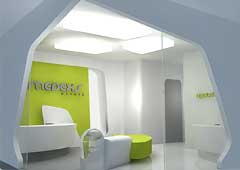
The height and width of the screenshot is (170, 240). In order to click on gray door in this screenshot , I will do `click(173, 98)`.